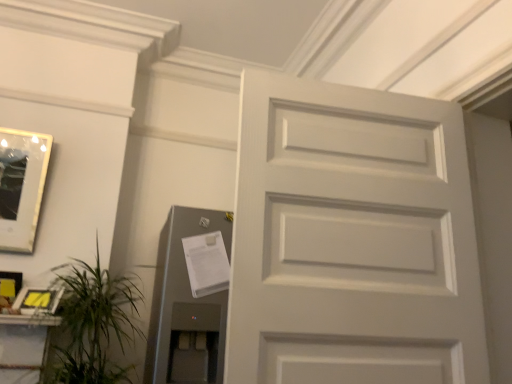
Question: Is the depth of white matte door at center less than that of metallic gray elevator at lower left?

Choices:
 (A) no
 (B) yes

Answer: (B)

Question: Does white matte door at center have a lesser height compared to metallic gray elevator at lower left?

Choices:
 (A) yes
 (B) no

Answer: (B)

Question: Is white matte door at center wider than metallic gray elevator at lower left?

Choices:
 (A) yes
 (B) no

Answer: (B)

Question: From the image's perspective, would you say white matte door at center is shown under metallic gray elevator at lower left?

Choices:
 (A) yes
 (B) no

Answer: (B)

Question: Is white matte door at center placed right next to metallic gray elevator at lower left?

Choices:
 (A) yes
 (B) no

Answer: (B)

Question: From a real-world perspective, relative to matte black picture frame at lower left, which appears as the second picture frame when ordered from the bottom, is matte silver picture frame at lower left, positioned as the first picture frame in bottom-to-top order, vertically above or below?

Choices:
 (A) below
 (B) above

Answer: (A)

Question: Considering their positions, is matte silver picture frame at lower left, positioned as the first picture frame in bottom-to-top order, located in front of or behind matte black picture frame at lower left, the second picture frame positioned from the top?

Choices:
 (A) behind
 (B) front

Answer: (B)

Question: Is point (31, 299) closer or farther from the camera than point (14, 283)?

Choices:
 (A) farther
 (B) closer

Answer: (B)

Question: From the image's perspective, relative to matte black picture frame at lower left, the second picture frame positioned from the top, is matte silver picture frame at lower left, positioned as the first picture frame in bottom-to-top order, above or below?

Choices:
 (A) above
 (B) below

Answer: (B)

Question: In terms of height, does metallic gray elevator at lower left look taller or shorter compared to white matte door at center?

Choices:
 (A) tall
 (B) short

Answer: (B)

Question: From the image's perspective, is metallic gray elevator at lower left above or below white matte door at center?

Choices:
 (A) below
 (B) above

Answer: (A)

Question: From a real-world perspective, relative to white matte door at center, is metallic gray elevator at lower left vertically above or below?

Choices:
 (A) below
 (B) above

Answer: (A)

Question: Would you say metallic gray elevator at lower left is inside or outside white matte door at center?

Choices:
 (A) inside
 (B) outside

Answer: (B)

Question: Looking at the image, does matte black picture frame at lower left, the second picture frame positioned from the top, seem bigger or smaller compared to white matte door at center?

Choices:
 (A) big
 (B) small

Answer: (B)

Question: From the image's perspective, is matte black picture frame at lower left, the second picture frame positioned from the top, above or below white matte door at center?

Choices:
 (A) above
 (B) below

Answer: (B)